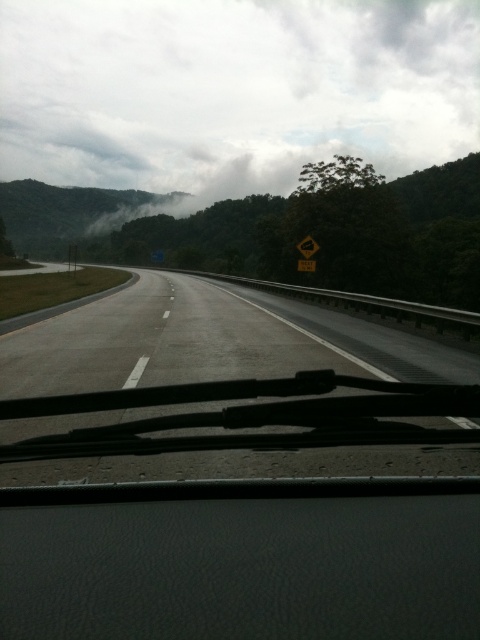
Who is higher up, white fluffy cloud at upper center or yellow reflective road sign at center?

white fluffy cloud at upper center is higher up.

Is white fluffy cloud at upper center smaller than yellow reflective road sign at center?

Actually, white fluffy cloud at upper center might be larger than yellow reflective road sign at center.

At what (x,y) coordinates should I click in order to perform the action: click on white fluffy cloud at upper center. Please return your answer as a coordinate pair (x, y). Image resolution: width=480 pixels, height=640 pixels. Looking at the image, I should click on (232, 90).

Which of these two, gray asphalt highway at center or yellow reflective road sign at center, stands taller?

gray asphalt highway at center is taller.

Between gray asphalt highway at center and yellow reflective road sign at center, which one has less height?

Standing shorter between the two is yellow reflective road sign at center.

Which is in front, point (181, 364) or point (311, 236)?

Point (181, 364)

You are a GUI agent. You are given a task and a screenshot of the screen. Output one action in this format:
    pyautogui.click(x=<x>, y=<y>)
    Task: Click on the gray asphalt highway at center
    This screenshot has width=480, height=640.
    Given the screenshot: What is the action you would take?
    pyautogui.click(x=197, y=342)

Identify the location of white fluffy cloud at upper center. This screenshot has height=640, width=480. (232, 90).

Is white fluffy cloud at upper center above gray asphalt highway at center?

Correct, white fluffy cloud at upper center is located above gray asphalt highway at center.

Which is behind, point (41, 77) or point (215, 314)?

Positioned behind is point (41, 77).

The image size is (480, 640). I want to click on white fluffy cloud at upper center, so click(x=232, y=90).